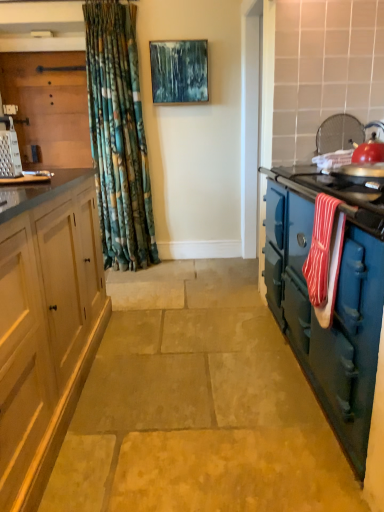
Find the location of a particular element. The height and width of the screenshot is (512, 384). vacant space situated above brushed metal grater at left, placed as the 1th cabinetry when sorted from top to bottom (from a real-world perspective) is located at coordinates (44, 53).